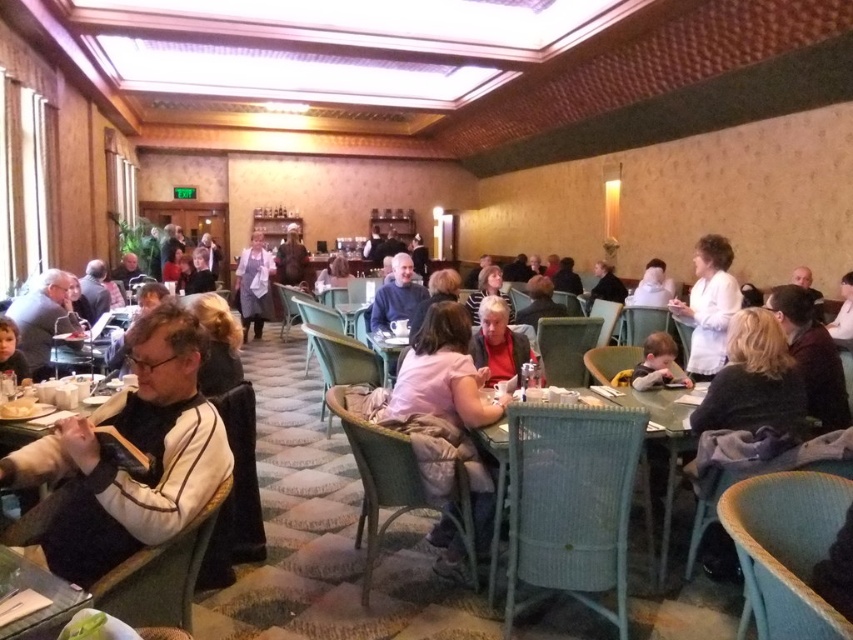
You are standing at the entrance of the dining area and want to find the teal wicker table at center. According to the coordinates provided, in which general direction should you walk to reach it?

The teal wicker table at center is located at coordinates point (665, 456). Since the coordinates are both greater than 0.5, this indicates that the table is positioned towards the lower right quadrant of the room. Therefore, you should walk towards the lower right direction to reach it.

You are a server in the dining area and need to deliver a drink to the person wearing the pink fabric shirt at center and the white matte coat at upper right. Which customer should you approach first if you want to serve the one closer to you?

You should approach the pink fabric shirt at center first because it is closer to the viewer than the white matte coat at upper right.

You are standing at the point marked as point (x=192, y=445) in the image. You want to move to the entrance of the dining area, which is located at the opposite side of the room. There is a 1.5 meter wide cart blocking your path. Can you navigate around it without moving the cart?

The distance between you and the entrance is not specified, but the cart is 1.5 meters wide. Since you need to go around it, you would need enough space on either side. However, without knowing the exact layout or the distance to the entrance, it is impossible to determine if you can navigate around the cart without moving it.